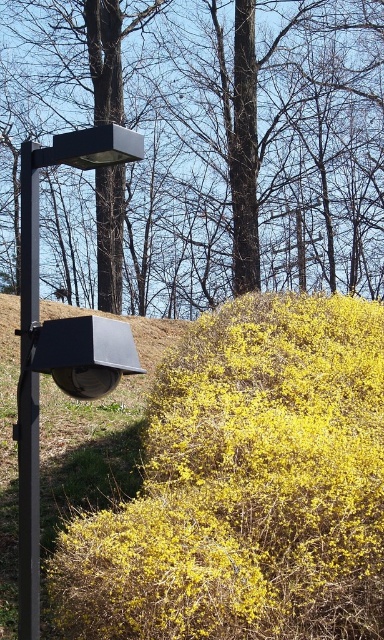
Question: Which object is positioned closest to the metallic black street sign at left?

Choices:
 (A) brown wood tree at upper center
 (B) black metal pole at left
 (C) yellow matte bush at center

Answer: (B)

Question: Does brown wood tree at upper center appear over yellow matte bush at center?

Choices:
 (A) yes
 (B) no

Answer: (A)

Question: Estimate the real-world distances between objects in this image. Which object is closer to the black metal pole at left?

Choices:
 (A) yellow matte bush at center
 (B) metallic black street sign at left

Answer: (B)

Question: Is metallic black street sign at left thinner than black metal pole at left?

Choices:
 (A) yes
 (B) no

Answer: (B)

Question: Based on their relative distances, which object is nearer to the metallic black street sign at left?

Choices:
 (A) yellow matte bush at center
 (B) black metal pole at left

Answer: (B)

Question: Does brown wood tree at upper center have a lesser width compared to black metal pole at left?

Choices:
 (A) yes
 (B) no

Answer: (B)